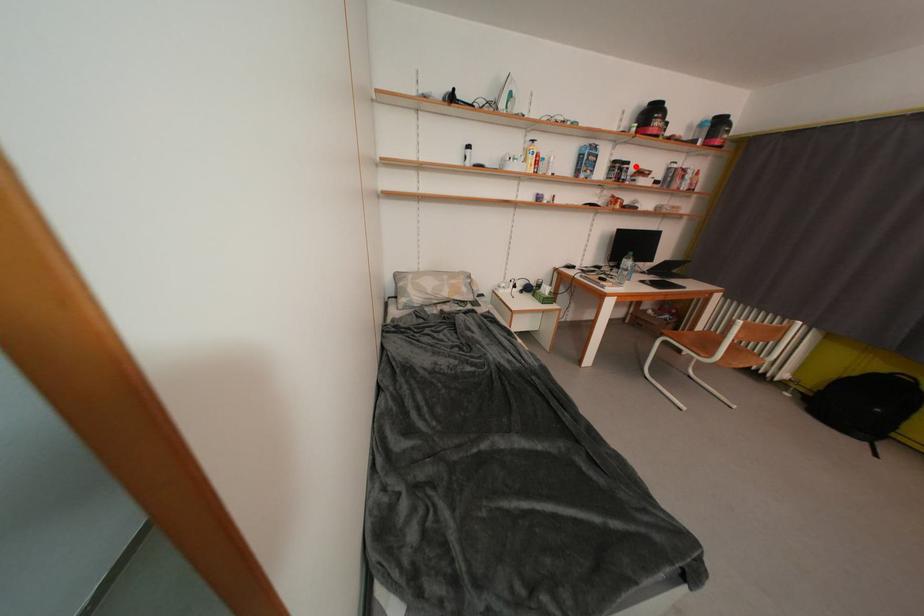
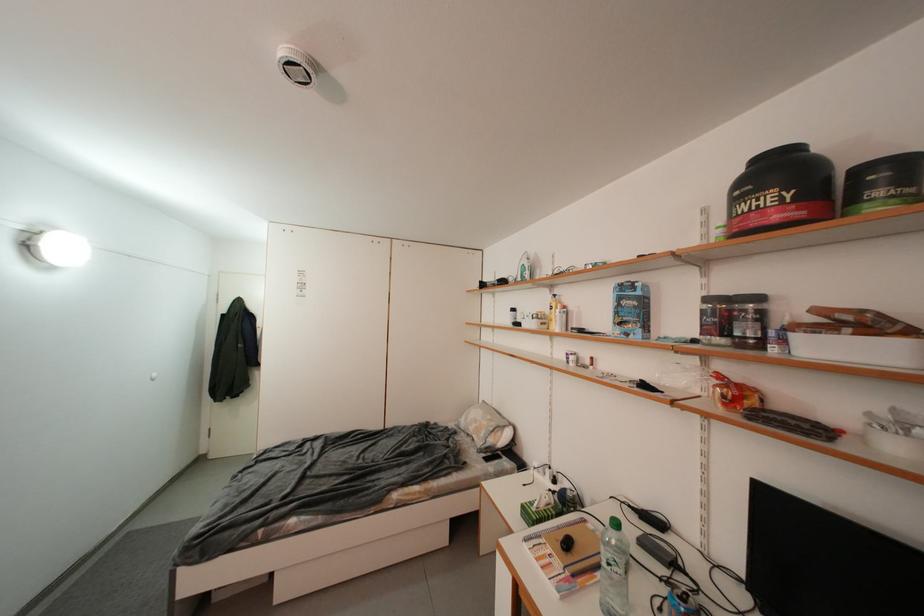
In the second image, find the point that corresponds to the highlighted location in the first image.

(766, 301)